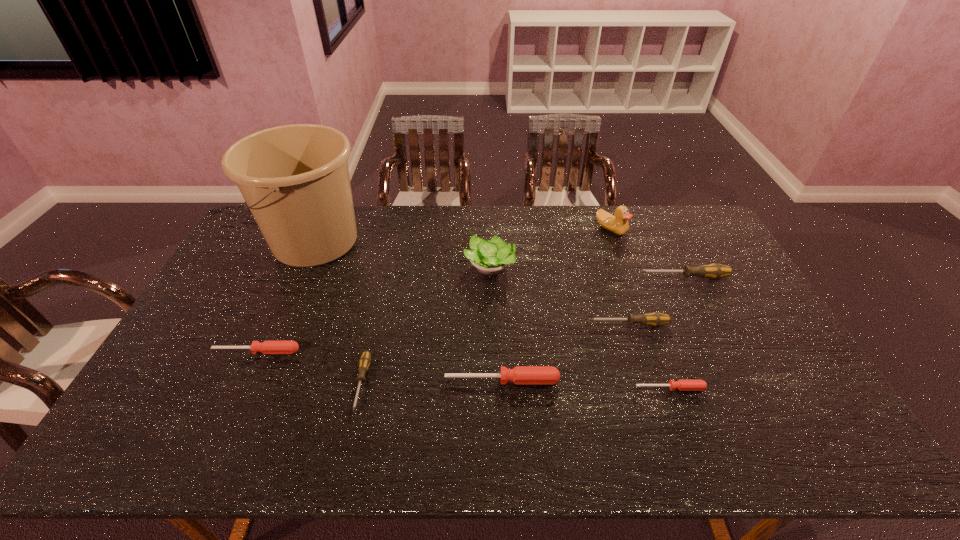
Where is `the tallest object`? The image size is (960, 540). the tallest object is located at coordinates (295, 179).

Locate an element on the screen. The image size is (960, 540). beige bucket is located at coordinates (295, 179).

At what (x,y) coordinates should I click in order to perform the action: click on the second tallest object. Please return your answer as a coordinate pair (x, y). This screenshot has height=540, width=960. Looking at the image, I should click on (618, 224).

Locate an element on the screen. duck is located at coordinates (618, 224).

Image resolution: width=960 pixels, height=540 pixels. Find the location of `lettuce`. lettuce is located at coordinates (491, 257).

In order to click on green lettuce in this screenshot , I will do `click(491, 257)`.

Where is `the farthest screwdriver`? The width and height of the screenshot is (960, 540). the farthest screwdriver is located at coordinates (714, 271).

Locate an element on the screen. The image size is (960, 540). the farthest gray screwdriver is located at coordinates (714, 271).

What are the coordinates of `the second smallest gray screwdriver` in the screenshot? It's located at (x=656, y=319).

Find the location of `the fifth nearest screwdriver`. the fifth nearest screwdriver is located at coordinates (656, 319).